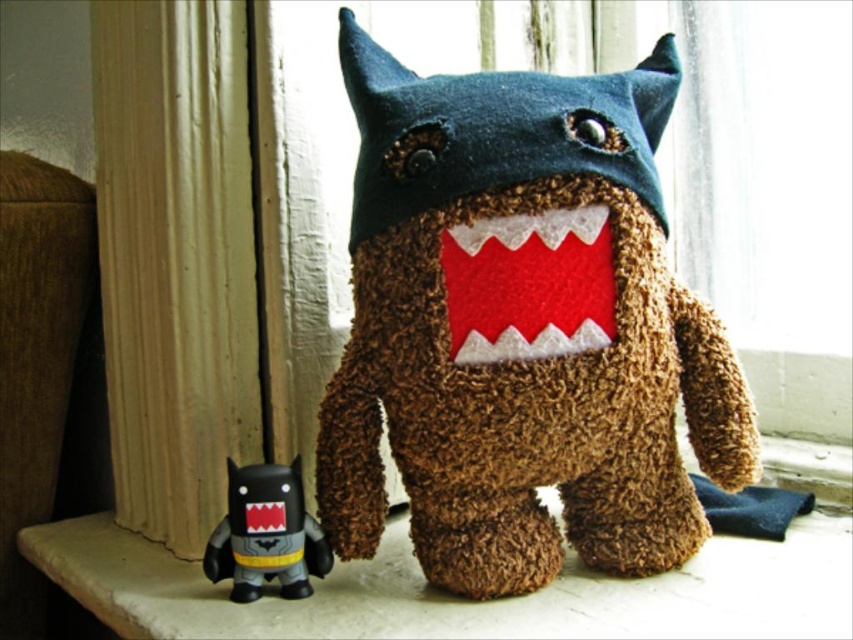
Does brown fuzzy stuffed toy at center appear over matte black toy at lower left?

Correct, brown fuzzy stuffed toy at center is located above matte black toy at lower left.

Is brown fuzzy stuffed toy at center in front of matte black toy at lower left?

Yes, brown fuzzy stuffed toy at center is closer to the viewer.

Between point (531, 145) and point (244, 596), which one is positioned in front?

Point (531, 145) is in front.

Locate an element on the screen. brown fuzzy stuffed toy at center is located at coordinates (520, 332).